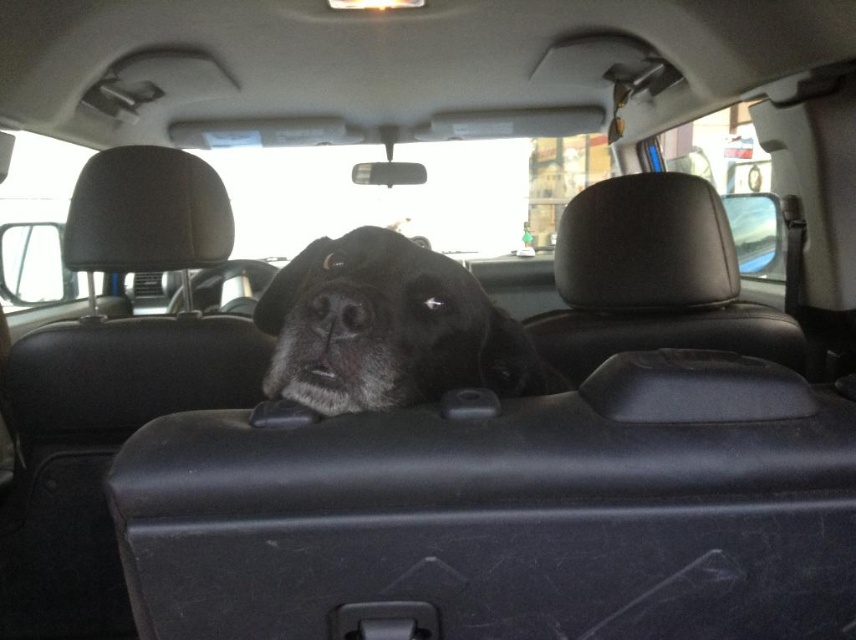
Who is positioned more to the left, black fur dog at center or black matte nose at center?

black matte nose at center is more to the left.

Does black fur dog at center appear on the right side of black matte nose at center?

Correct, you'll find black fur dog at center to the right of black matte nose at center.

Is point (314, 369) farther from camera compared to point (337, 326)?

Yes, point (314, 369) is behind point (337, 326).

The image size is (856, 640). I want to click on black fur dog at center, so click(388, 328).